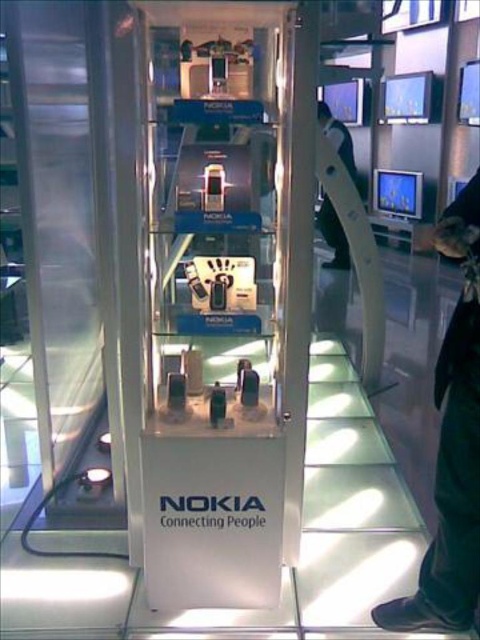
Can you confirm if black fabric pants at lower right is positioned to the right of black leather jacket at upper center?

In fact, black fabric pants at lower right is to the left of black leather jacket at upper center.

What are the coordinates of `black fabric pants at lower right` in the screenshot? It's located at (451, 490).